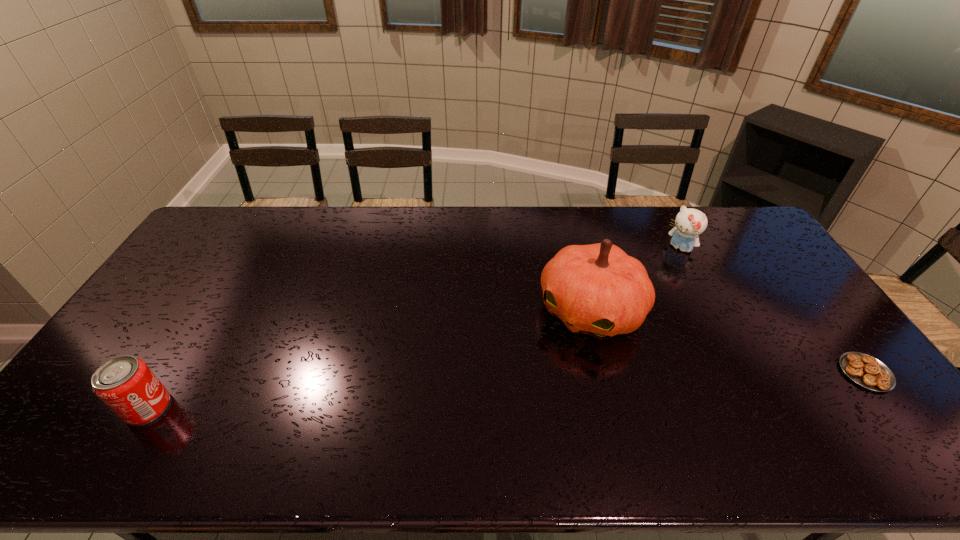
Identify the location of free spot that satisfies the following two spatial constraints: 1. on the back side of the kitten; 2. on the right side of the leftmost object. The height and width of the screenshot is (540, 960). (246, 249).

Where is `free space that satisfies the following two spatial constraints: 1. on the back side of the leftmost object; 2. on the left side of the shortest object`? This screenshot has height=540, width=960. free space that satisfies the following two spatial constraints: 1. on the back side of the leftmost object; 2. on the left side of the shortest object is located at coordinates (170, 373).

At what (x,y) coordinates should I click in order to perform the action: click on vacant region that satisfies the following two spatial constraints: 1. on the front side of the tallest object; 2. on the left side of the rightmost object. Please return your answer as a coordinate pair (x, y). The image size is (960, 540). Looking at the image, I should click on [x=606, y=373].

The height and width of the screenshot is (540, 960). I want to click on free space that satisfies the following two spatial constraints: 1. on the front side of the farthest object; 2. on the right side of the rightmost object, so click(x=744, y=373).